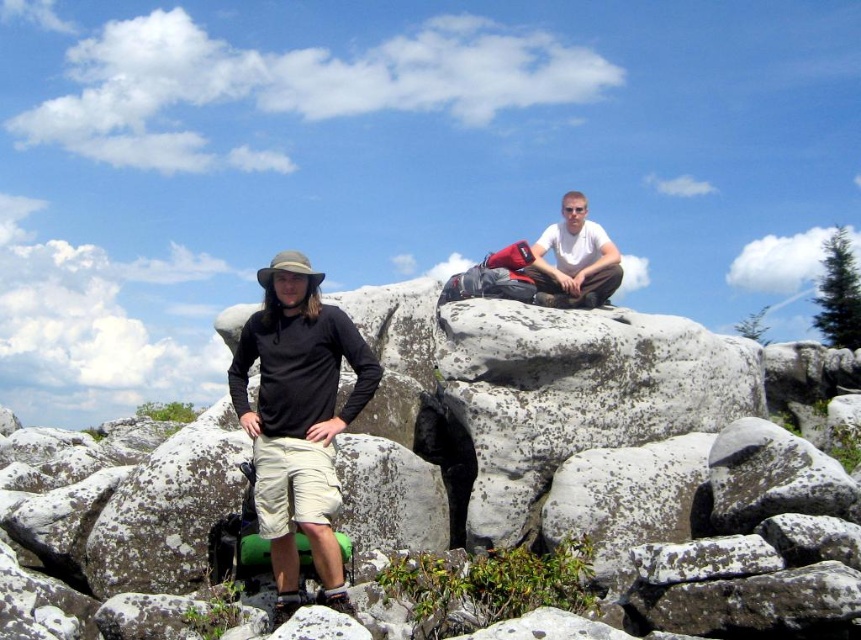
Which is above, black matte shirt at center or white matte shirt at upper center?

white matte shirt at upper center is above.

Which is behind, point (292, 371) or point (605, 273)?

Point (605, 273)

You are a GUI agent. You are given a task and a screenshot of the screen. Output one action in this format:
    pyautogui.click(x=<x>, y=<y>)
    Task: Click on the black matte shirt at center
    This screenshot has height=640, width=861.
    Given the screenshot: What is the action you would take?
    pyautogui.click(x=298, y=419)

At what (x,y) coordinates should I click in order to perform the action: click on black matte shirt at center. Please return your answer as a coordinate pair (x, y). Looking at the image, I should click on (298, 419).